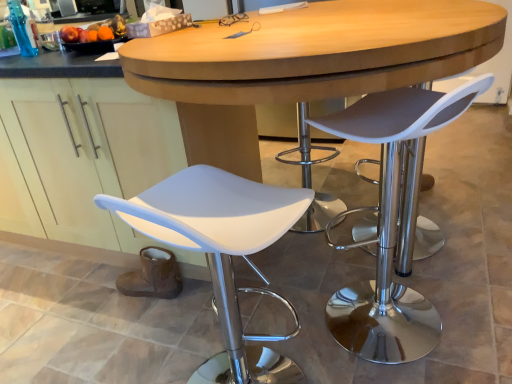
The image size is (512, 384). Describe the element at coordinates (218, 241) in the screenshot. I see `white matte chair at lower left, which is the 2th chair in right-to-left order` at that location.

Where is `white matte chair at lower left, which is counted as the first chair, starting from the left`? The height and width of the screenshot is (384, 512). white matte chair at lower left, which is counted as the first chair, starting from the left is located at coordinates [218, 241].

Where is `matte gray seat at right, placed as the second chair when sorted from left to right`? The height and width of the screenshot is (384, 512). matte gray seat at right, placed as the second chair when sorted from left to right is located at coordinates (392, 221).

What do you see at coordinates (392, 221) in the screenshot?
I see `matte gray seat at right, which is counted as the first chair, starting from the right` at bounding box center [392, 221].

Where is `white matte chair at lower left, which is counted as the first chair, starting from the left`? The height and width of the screenshot is (384, 512). white matte chair at lower left, which is counted as the first chair, starting from the left is located at coordinates 218,241.

Which object is positioned more to the left, matte gray seat at right, which is counted as the first chair, starting from the right, or white matte chair at lower left, which is the 2th chair in right-to-left order?

white matte chair at lower left, which is the 2th chair in right-to-left order, is more to the left.

Is the depth of matte gray seat at right, placed as the second chair when sorted from left to right, greater than that of white matte chair at lower left, which is the 2th chair in right-to-left order?

That is True.

Does point (357, 321) come closer to viewer compared to point (250, 217)?

No, (357, 321) is behind (250, 217).

From the image's perspective, is matte gray seat at right, which is counted as the first chair, starting from the right, under white matte chair at lower left, which is counted as the first chair, starting from the left?

No.

Based on the photo, from a real-world perspective, relative to white matte chair at lower left, which is the 2th chair in right-to-left order, is matte gray seat at right, which is counted as the first chair, starting from the right, vertically above or below?

matte gray seat at right, which is counted as the first chair, starting from the right, is above white matte chair at lower left, which is the 2th chair in right-to-left order.

Is matte gray seat at right, placed as the second chair when sorted from left to right, wider or thinner than white matte chair at lower left, which is the 2th chair in right-to-left order?

matte gray seat at right, placed as the second chair when sorted from left to right, is thinner than white matte chair at lower left, which is the 2th chair in right-to-left order.

Is matte gray seat at right, placed as the second chair when sorted from left to right, taller than white matte chair at lower left, which is the 2th chair in right-to-left order?

Correct, matte gray seat at right, placed as the second chair when sorted from left to right, is much taller as white matte chair at lower left, which is the 2th chair in right-to-left order.

In the scene shown: Considering the sizes of matte gray seat at right, which is counted as the first chair, starting from the right, and white matte chair at lower left, which is counted as the first chair, starting from the left, in the image, is matte gray seat at right, which is counted as the first chair, starting from the right, bigger or smaller than white matte chair at lower left, which is counted as the first chair, starting from the left,?

Clearly, matte gray seat at right, which is counted as the first chair, starting from the right, is larger in size than white matte chair at lower left, which is counted as the first chair, starting from the left.

Is matte gray seat at right, placed as the second chair when sorted from left to right, spatially inside white matte chair at lower left, which is counted as the first chair, starting from the left, or outside of it?

matte gray seat at right, placed as the second chair when sorted from left to right, cannot be found inside white matte chair at lower left, which is counted as the first chair, starting from the left.

Is matte gray seat at right, placed as the second chair when sorted from left to right, not near white matte chair at lower left, which is counted as the first chair, starting from the left?

matte gray seat at right, placed as the second chair when sorted from left to right, is near white matte chair at lower left, which is counted as the first chair, starting from the left, not far away.

Is matte gray seat at right, placed as the second chair when sorted from left to right, oriented towards white matte chair at lower left, which is counted as the first chair, starting from the left?

No, matte gray seat at right, placed as the second chair when sorted from left to right, is not oriented towards white matte chair at lower left, which is counted as the first chair, starting from the left.

How different are the orientations of matte gray seat at right, placed as the second chair when sorted from left to right, and white matte chair at lower left, which is counted as the first chair, starting from the left, in degrees?

The angular difference between matte gray seat at right, placed as the second chair when sorted from left to right, and white matte chair at lower left, which is counted as the first chair, starting from the left, is 77.9 degrees.

Identify the location of chair behind the white matte chair at lower left, which is the 2th chair in right-to-left order. (392, 221).

Is white matte chair at lower left, which is counted as the first chair, starting from the left, at the left side of matte gray seat at right, which is counted as the first chair, starting from the right?

Yes, white matte chair at lower left, which is counted as the first chair, starting from the left, is to the left of matte gray seat at right, which is counted as the first chair, starting from the right.

Is white matte chair at lower left, which is counted as the first chair, starting from the left, closer to camera compared to matte gray seat at right, which is counted as the first chair, starting from the right?

Yes.

Is point (98, 196) closer to camera compared to point (420, 357)?

That is True.

From the image's perspective, is white matte chair at lower left, which is the 2th chair in right-to-left order, beneath matte gray seat at right, placed as the second chair when sorted from left to right?

Yes, from the image's perspective, white matte chair at lower left, which is the 2th chair in right-to-left order, is below matte gray seat at right, placed as the second chair when sorted from left to right.

From a real-world perspective, is white matte chair at lower left, which is the 2th chair in right-to-left order, positioned over matte gray seat at right, which is counted as the first chair, starting from the right, based on gravity?

Actually, white matte chair at lower left, which is the 2th chair in right-to-left order, is physically below matte gray seat at right, which is counted as the first chair, starting from the right, in the real world.

Is white matte chair at lower left, which is counted as the first chair, starting from the left, wider than matte gray seat at right, which is counted as the first chair, starting from the right?

Correct, the width of white matte chair at lower left, which is counted as the first chair, starting from the left, exceeds that of matte gray seat at right, which is counted as the first chair, starting from the right.

Between white matte chair at lower left, which is the 2th chair in right-to-left order, and matte gray seat at right, placed as the second chair when sorted from left to right, which one has less height?

white matte chair at lower left, which is the 2th chair in right-to-left order, is shorter.

Can you confirm if white matte chair at lower left, which is counted as the first chair, starting from the left, is smaller than matte gray seat at right, placed as the second chair when sorted from left to right?

Yes, white matte chair at lower left, which is counted as the first chair, starting from the left, is smaller than matte gray seat at right, placed as the second chair when sorted from left to right.

Would you say matte gray seat at right, placed as the second chair when sorted from left to right, is part of white matte chair at lower left, which is counted as the first chair, starting from the left,'s contents?

That's incorrect, matte gray seat at right, placed as the second chair when sorted from left to right, is not inside white matte chair at lower left, which is counted as the first chair, starting from the left.

Would you consider white matte chair at lower left, which is counted as the first chair, starting from the left, to be distant from matte gray seat at right, which is counted as the first chair, starting from the right?

No, white matte chair at lower left, which is counted as the first chair, starting from the left, is not far from matte gray seat at right, which is counted as the first chair, starting from the right.

Is white matte chair at lower left, which is the 2th chair in right-to-left order, oriented towards matte gray seat at right, which is counted as the first chair, starting from the right?

Yes, white matte chair at lower left, which is the 2th chair in right-to-left order, is turned towards matte gray seat at right, which is counted as the first chair, starting from the right.

In the scene shown: What's the angular difference between white matte chair at lower left, which is the 2th chair in right-to-left order, and matte gray seat at right, placed as the second chair when sorted from left to right,'s facing directions?

77.9 degrees.

The width and height of the screenshot is (512, 384). Find the location of `chair that appears below the matte gray seat at right, placed as the second chair when sorted from left to right (from the image's perspective)`. chair that appears below the matte gray seat at right, placed as the second chair when sorted from left to right (from the image's perspective) is located at coordinates (218, 241).

At what (x,y) coordinates should I click in order to perform the action: click on chair below the matte gray seat at right, placed as the second chair when sorted from left to right (from the image's perspective). Please return your answer as a coordinate pair (x, y). Looking at the image, I should click on (218, 241).

At what (x,y) coordinates should I click in order to perform the action: click on chair lying in front of the matte gray seat at right, which is counted as the first chair, starting from the right. Please return your answer as a coordinate pair (x, y). The height and width of the screenshot is (384, 512). Looking at the image, I should click on (218, 241).